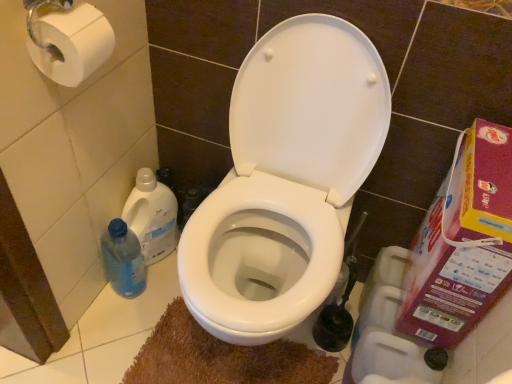
Find the location of a particular element. The height and width of the screenshot is (384, 512). unoccupied region to the right of blue translucent bottle at left, the second cleaning product from the top is located at coordinates (161, 292).